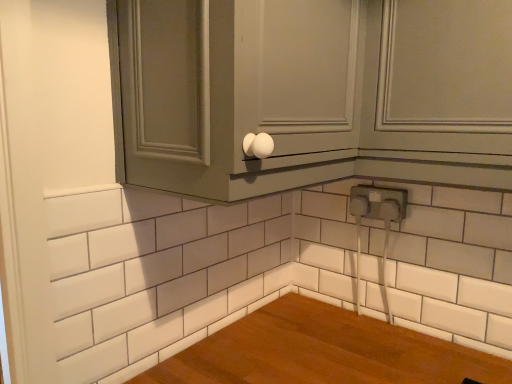
Question: Considering the positions of point (485, 41) and point (353, 193), is point (485, 41) closer or farther from the camera than point (353, 193)?

Choices:
 (A) closer
 (B) farther

Answer: (A)

Question: Is matte gray cabinet at upper right spatially inside white plastic electrical outlet at lower right, or outside of it?

Choices:
 (A) inside
 (B) outside

Answer: (B)

Question: Estimate the real-world distances between objects in this image. Which object is farther from the white plastic electrical outlet at lower right?

Choices:
 (A) matte gray cabinet at upper right
 (B) matte gray cabinet at upper center

Answer: (B)

Question: Estimate the real-world distances between objects in this image. Which object is farther from the matte gray cabinet at upper right?

Choices:
 (A) matte gray cabinet at upper center
 (B) white plastic electrical outlet at lower right

Answer: (B)